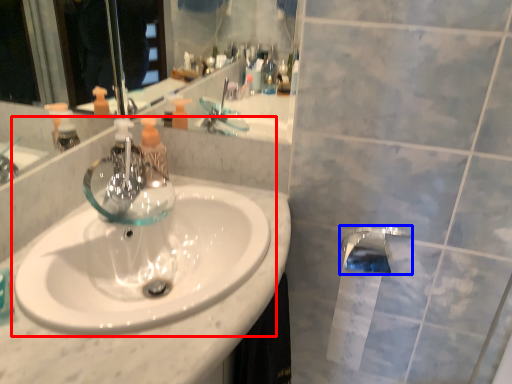
Question: Which object is further to the camera taking this photo, sink (highlighted by a red box) or tap (highlighted by a blue box)?

Choices:
 (A) sink
 (B) tap

Answer: (B)